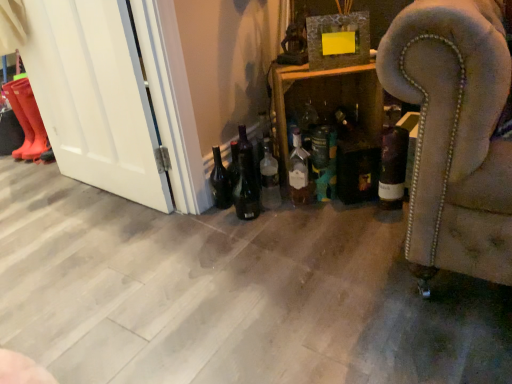
Locate an element on the screen. Image resolution: width=512 pixels, height=384 pixels. vacant space to the left of matte glass bottle at lower left, the 1th beer bottle from the left is located at coordinates (197, 218).